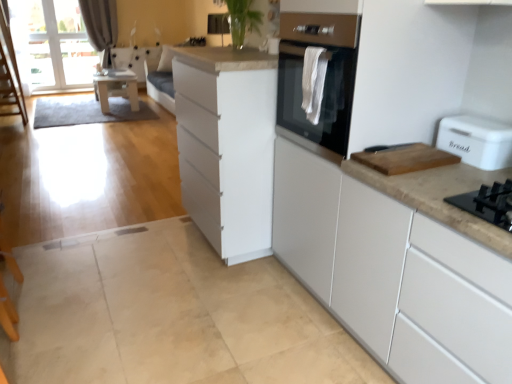
Question: Does white matte cabinet at center, marked as the 2th cabinetry in a right-to-left arrangement, have a lesser height compared to gray fabric curtain at upper left?

Choices:
 (A) yes
 (B) no

Answer: (A)

Question: Is white matte cabinet at center, marked as the 2th cabinetry in a right-to-left arrangement, facing towards gray fabric curtain at upper left?

Choices:
 (A) no
 (B) yes

Answer: (A)

Question: Considering the relative sizes of white matte cabinet at center, marked as the 2th cabinetry in a right-to-left arrangement, and gray fabric curtain at upper left in the image provided, is white matte cabinet at center, marked as the 2th cabinetry in a right-to-left arrangement, taller than gray fabric curtain at upper left?

Choices:
 (A) no
 (B) yes

Answer: (A)

Question: From the image's perspective, is white matte cabinet at center, positioned as the 1th cabinetry in left-to-right order, located above gray fabric curtain at upper left?

Choices:
 (A) no
 (B) yes

Answer: (A)

Question: Is white matte cabinet at center, marked as the 2th cabinetry in a right-to-left arrangement, behind gray fabric curtain at upper left?

Choices:
 (A) no
 (B) yes

Answer: (A)

Question: From the image's perspective, relative to gray fabric curtain at upper left, is wooden cutting board at right above or below?

Choices:
 (A) above
 (B) below

Answer: (B)

Question: Considering the positions of wooden cutting board at right and gray fabric curtain at upper left in the image, is wooden cutting board at right wider or thinner than gray fabric curtain at upper left?

Choices:
 (A) thin
 (B) wide

Answer: (B)

Question: Considering the relative positions of wooden cutting board at right and gray fabric curtain at upper left in the image provided, is wooden cutting board at right to the left or to the right of gray fabric curtain at upper left?

Choices:
 (A) left
 (B) right

Answer: (B)

Question: Is wooden cutting board at right inside or outside of gray fabric curtain at upper left?

Choices:
 (A) inside
 (B) outside

Answer: (B)

Question: Considering the positions of point (462, 134) and point (130, 72), is point (462, 134) closer or farther from the camera than point (130, 72)?

Choices:
 (A) closer
 (B) farther

Answer: (A)

Question: Relative to wooden table at left, is white plastic bread bin at right in front or behind?

Choices:
 (A) front
 (B) behind

Answer: (A)

Question: From a real-world perspective, is white plastic bread bin at right positioned above or below wooden table at left?

Choices:
 (A) above
 (B) below

Answer: (A)

Question: Based on their sizes in the image, would you say white plastic bread bin at right is bigger or smaller than wooden table at left?

Choices:
 (A) small
 (B) big

Answer: (A)

Question: From a real-world perspective, is transparent glass window screen at upper left physically located above or below wooden cutting board at right?

Choices:
 (A) below
 (B) above

Answer: (A)

Question: Is transparent glass window screen at upper left inside the boundaries of wooden cutting board at right, or outside?

Choices:
 (A) outside
 (B) inside

Answer: (A)